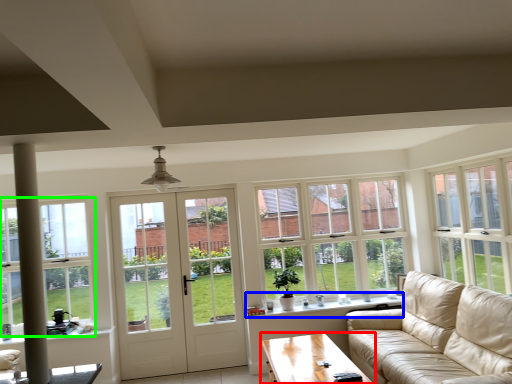
Question: Considering the real-world distances, which object is farthest from coffee table (highlighted by a red box)? window sill (highlighted by a blue box) or window (highlighted by a green box)?

Choices:
 (A) window sill
 (B) window

Answer: (B)